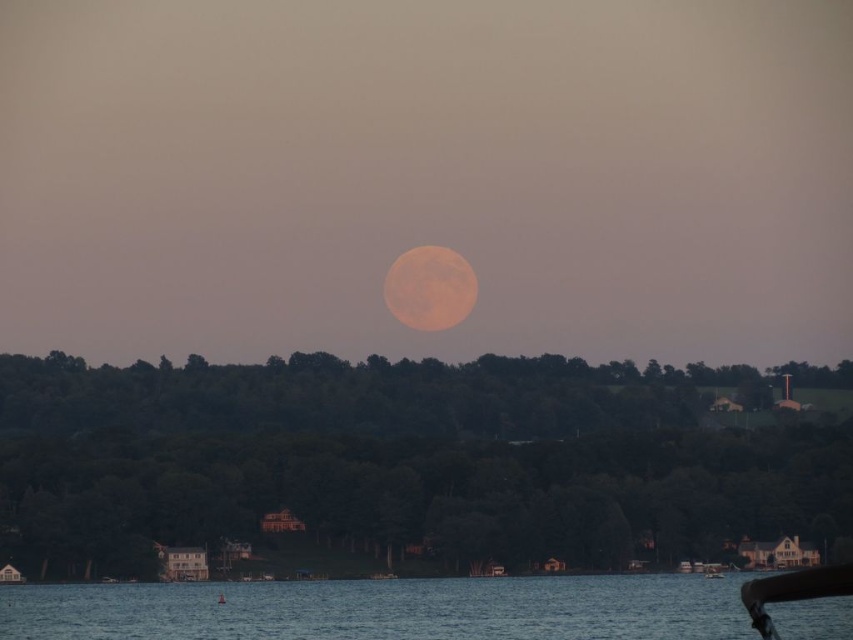
Question: Does orange matte moon at center have a smaller size compared to wooden boat at center?

Choices:
 (A) no
 (B) yes

Answer: (A)

Question: Is orange matte moon at center further to camera compared to orange textured moon at center?

Choices:
 (A) no
 (B) yes

Answer: (A)

Question: Estimate the real-world distances between objects in this image. Which object is closer to the wooden boat at center?

Choices:
 (A) blue water at lower center
 (B) orange matte moon at center

Answer: (A)

Question: Does blue water at lower center have a lesser width compared to orange textured moon at center?

Choices:
 (A) yes
 (B) no

Answer: (B)

Question: Which point is closer to the camera?

Choices:
 (A) (430, 278)
 (B) (712, 573)
 (C) (653, 579)

Answer: (A)

Question: Estimate the real-world distances between objects in this image. Which object is farther from the wooden boat at center?

Choices:
 (A) orange matte moon at center
 (B) blue water at lower center
 (C) orange textured moon at center

Answer: (C)